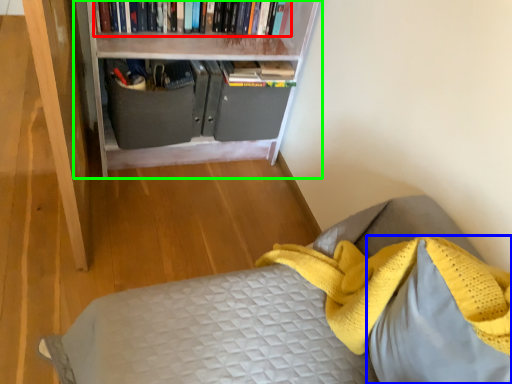
Question: Based on their relative distances, which object is nearer to book (highlighted by a red box)? Choose from pillow (highlighted by a blue box) and bookcase (highlighted by a green box).

Choices:
 (A) pillow
 (B) bookcase

Answer: (B)